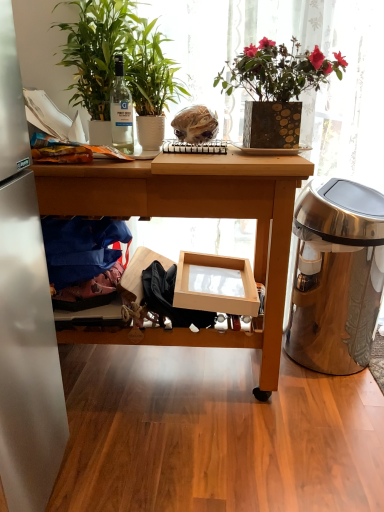
Question: Can you confirm if green matte plant at left, the second houseplant viewed from the right, is positioned to the left of stainless steel trash can at right?

Choices:
 (A) yes
 (B) no

Answer: (A)

Question: From a real-world perspective, is green matte plant at left, which ranks as the 1th houseplant in left-to-right order, below stainless steel trash can at right?

Choices:
 (A) no
 (B) yes

Answer: (A)

Question: Does green matte plant at left, the second houseplant viewed from the right, have a lesser height compared to stainless steel trash can at right?

Choices:
 (A) yes
 (B) no

Answer: (A)

Question: Considering the relative sizes of green matte plant at left, the second houseplant viewed from the right, and stainless steel trash can at right in the image provided, is green matte plant at left, the second houseplant viewed from the right, thinner than stainless steel trash can at right?

Choices:
 (A) yes
 (B) no

Answer: (B)

Question: Can you confirm if green matte plant at left, the second houseplant viewed from the right, is bigger than stainless steel trash can at right?

Choices:
 (A) yes
 (B) no

Answer: (B)

Question: Is green matte plant at left, the second houseplant viewed from the right, behind stainless steel trash can at right?

Choices:
 (A) yes
 (B) no

Answer: (B)

Question: Is blue fabric at left completely or partially inside stainless steel trash can at right?

Choices:
 (A) no
 (B) yes

Answer: (A)

Question: Considering the relative positions of stainless steel trash can at right and blue fabric at left in the image provided, is stainless steel trash can at right in front of blue fabric at left?

Choices:
 (A) yes
 (B) no

Answer: (B)

Question: Considering the relative sizes of stainless steel trash can at right and blue fabric at left in the image provided, is stainless steel trash can at right thinner than blue fabric at left?

Choices:
 (A) no
 (B) yes

Answer: (A)

Question: From the image's perspective, is stainless steel trash can at right on top of blue fabric at left?

Choices:
 (A) no
 (B) yes

Answer: (A)

Question: Is stainless steel trash can at right aimed at blue fabric at left?

Choices:
 (A) no
 (B) yes

Answer: (A)

Question: From a real-world perspective, is stainless steel trash can at right physically below blue fabric at left?

Choices:
 (A) no
 (B) yes

Answer: (B)

Question: Can you confirm if translucent plastic bag at center is wider than blue fabric at left?

Choices:
 (A) yes
 (B) no

Answer: (B)